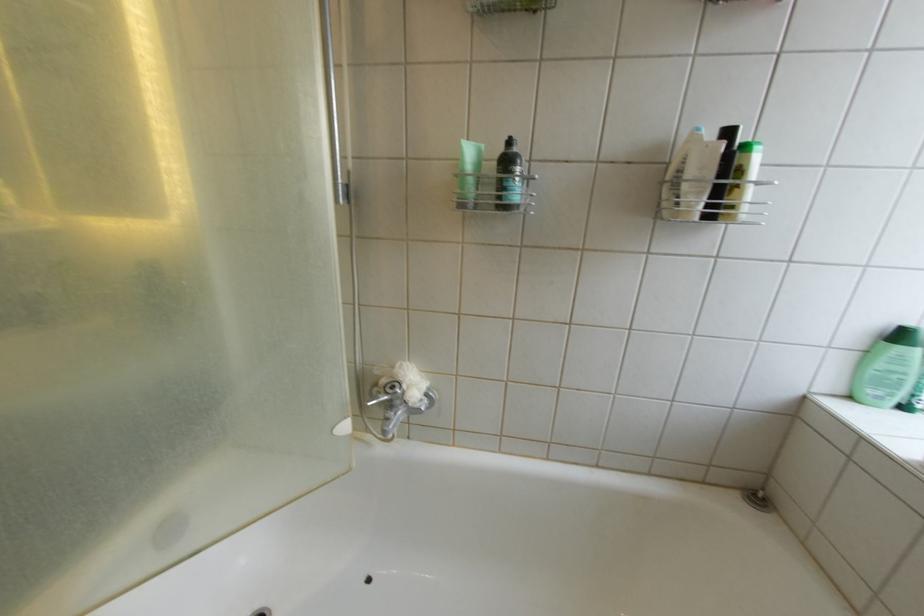
Where is `silver faucet handle`? The height and width of the screenshot is (616, 924). silver faucet handle is located at coordinates (397, 406).